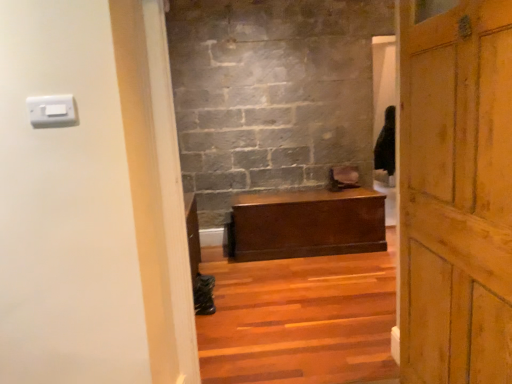
Question: In terms of width, does wooden door at right look wider or thinner when compared to matte brown wooden chest at center?

Choices:
 (A) wide
 (B) thin

Answer: (B)

Question: Is wooden door at right bigger or smaller than matte brown wooden chest at center?

Choices:
 (A) small
 (B) big

Answer: (A)

Question: Which of these objects is positioned farthest from the wooden door at right?

Choices:
 (A) matte brown wooden chest at center
 (B) white plastic light switch at upper left
 (C) wooden stairs at center

Answer: (A)

Question: Which object is the farthest from the matte brown wooden chest at center?

Choices:
 (A) wooden stairs at center
 (B) wooden door at right
 (C) white plastic light switch at upper left

Answer: (C)